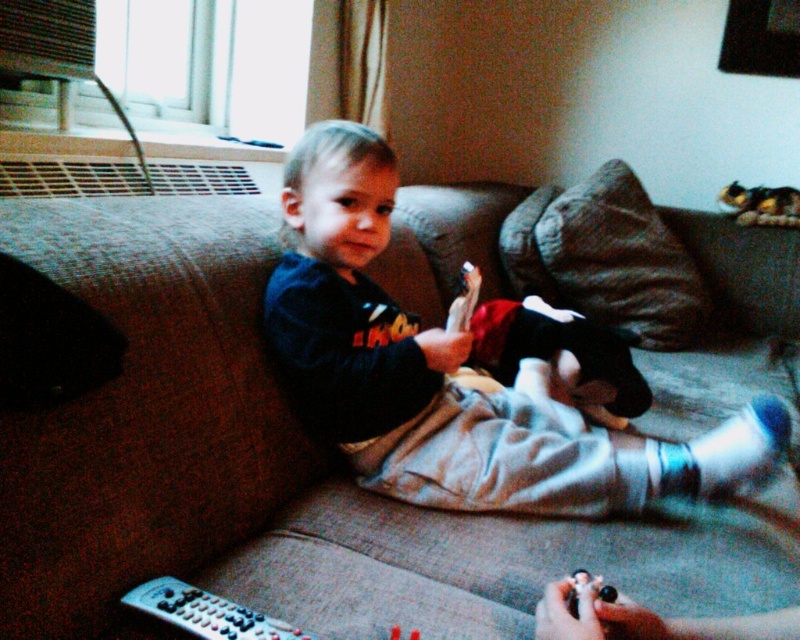
You are a designer trying to place a new lamp in the scene. The lamp requires a spot that is not occupied by the brown fabric couch at center. Based on the coordinates provided, can you confirm if the point at [282,467] is suitable for placing the lamp?

The point at [282,467] indicates the brown fabric couch at center, so placing the lamp there would not be suitable as it is occupied by the couch.

You are a delivery robot that needs to place a small package on the brown fabric couch at center without disturbing the black plastic remote at lower left. Can you fit the package between them if the package is 12 inches long?

The distance between the brown fabric couch at center and the black plastic remote at lower left is 21.88 inches. Since the package is only 12 inches long, there is enough space to place it between them without disturbing the remote.

You are a parent looking for your child who is sitting on the brown fabric couch at center. You see the black plastic remote at lower left. Which object is closer to the left side of the scene?

The black plastic remote at lower left is closer to the left side of the scene because the brown fabric couch at center is positioned on the right side of it.